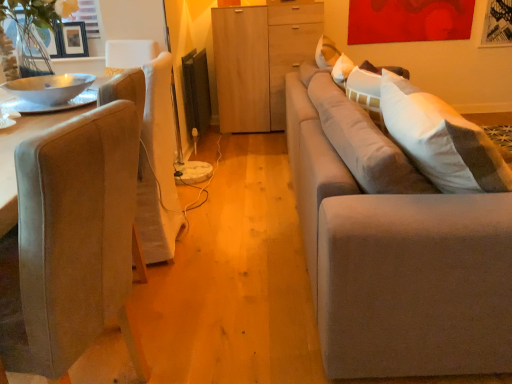
Locate an element on the screen. The width and height of the screenshot is (512, 384). suede gray couch at right is located at coordinates (393, 248).

The image size is (512, 384). Find the location of `white glossy bowl at left`. white glossy bowl at left is located at coordinates (49, 87).

Considering their positions, is matte black picture frame at upper left located in front of or behind suede-like beige chair at left?

matte black picture frame at upper left is behind suede-like beige chair at left.

Choose the correct answer: Is matte black picture frame at upper left inside suede-like beige chair at left or outside it?

matte black picture frame at upper left is outside suede-like beige chair at left.

From the image's perspective, is matte black picture frame at upper left above suede-like beige chair at left?

Yes, from the image's perspective, matte black picture frame at upper left is over suede-like beige chair at left.

Find the location of a particular element. picture frame on the left of suede-like beige chair at left is located at coordinates (73, 39).

Does point (70, 33) come farther from viewer compared to point (312, 221)?

Yes, it is.

Are matte black picture frame at upper left and suede gray couch at right making contact?

matte black picture frame at upper left is not next to suede gray couch at right, and they're not touching.

There is a suede gray couch at right. Where is `picture frame above it (from a real-world perspective)`? The width and height of the screenshot is (512, 384). picture frame above it (from a real-world perspective) is located at coordinates [73, 39].

From the image's perspective, which is below, matte black picture frame at upper left or suede gray couch at right?

From the image's view, suede gray couch at right is below.

Does white glossy bowl at left have a larger size compared to suede gray couch at right?

Actually, white glossy bowl at left might be smaller than suede gray couch at right.

Is white glossy bowl at left positioned with its back to suede gray couch at right?

No, suede gray couch at right is not at the back of white glossy bowl at left.

In the scene shown: From a real-world perspective, who is located lower, white glossy bowl at left or suede gray couch at right?

suede gray couch at right, from a real-world perspective.

What's the angular difference between white glossy bowl at left and suede gray couch at right's facing directions?

The facing directions of white glossy bowl at left and suede gray couch at right are 176 degrees apart.

Looking at their sizes, would you say white glossy bowl at left is wider or thinner than suede-like beige chair at left?

Clearly, white glossy bowl at left has less width compared to suede-like beige chair at left.

Based on the photo, who is bigger, white glossy bowl at left or suede-like beige chair at left?

suede-like beige chair at left is bigger.

Which of these two, white glossy bowl at left or suede-like beige chair at left, stands taller?

Standing taller between the two is suede-like beige chair at left.

Is point (70, 89) positioned in front of point (103, 258)?

That is False.

From the image's perspective, does suede gray couch at right appear higher than suede-like beige chair at left?

Yes, from the image's perspective, suede gray couch at right is above suede-like beige chair at left.

How much distance is there between suede gray couch at right and suede-like beige chair at left?

suede gray couch at right and suede-like beige chair at left are 75.94 centimeters apart from each other.

Which of these two, suede gray couch at right or suede-like beige chair at left, is wider?

With larger width is suede gray couch at right.

Is suede gray couch at right in contact with suede-like beige chair at left?

No, suede gray couch at right is not next to suede-like beige chair at left.

Identify the location of bowl on the left side of suede-like beige chair at left. Image resolution: width=512 pixels, height=384 pixels. (49, 87).

Who is more distant, suede-like beige chair at left or white glossy bowl at left?

white glossy bowl at left is more distant.

From a real-world perspective, who is located higher, suede-like beige chair at left or white glossy bowl at left?

In real-world perspective, white glossy bowl at left is above.

Is suede-like beige chair at left positioned far away from white glossy bowl at left?

That's right, there is a large distance between suede-like beige chair at left and white glossy bowl at left.

From a real-world perspective, between suede gray couch at right and white glossy bowl at left, who is vertically lower?

suede gray couch at right.

Is suede gray couch at right oriented away from white glossy bowl at left?

Absolutely, suede gray couch at right is directed away from white glossy bowl at left.

You are a GUI agent. You are given a task and a screenshot of the screen. Output one action in this format:
    pyautogui.click(x=<x>, y=<y>)
    Task: Click on the chair that appears on the right of matte black picture frame at upper left
    
    Given the screenshot: What is the action you would take?
    pyautogui.click(x=76, y=236)

The height and width of the screenshot is (384, 512). I want to click on studio couch located underneath the matte black picture frame at upper left (from a real-world perspective), so click(x=393, y=248).

When comparing their distances from white glossy bowl at left, does suede-like beige chair at left or suede gray couch at right seem further?

suede gray couch at right lies further to white glossy bowl at left than the other object.

When comparing their distances from matte black picture frame at upper left, does suede-like beige chair at left or light wood cabinet at center seem closer?

Based on the image, light wood cabinet at center appears to be nearer to matte black picture frame at upper left.

Based on their spatial positions, is suede-like beige chair at left or white glossy bowl at left further from matte black picture frame at upper left?

suede-like beige chair at left is further to matte black picture frame at upper left.

Considering their positions, is suede gray couch at right positioned closer to suede-like beige chair at left than white glossy bowl at left?

suede gray couch at right.

Based on their spatial positions, is light wood cabinet at center or suede-like beige chair at left closer to suede gray couch at right?

suede-like beige chair at left lies closer to suede gray couch at right than the other object.

Which object lies further to the anchor point suede-like beige chair at left, light wood cabinet at center or white glossy bowl at left?

Among the two, light wood cabinet at center is located further to suede-like beige chair at left.

Based on the photo, estimate the real-world distances between objects in this image. Which object is further from suede-like beige chair at left, matte black picture frame at upper left or suede gray couch at right?

matte black picture frame at upper left is further to suede-like beige chair at left.

Considering their positions, is suede gray couch at right positioned further to suede-like beige chair at left than light wood cabinet at center?

Among the two, light wood cabinet at center is located further to suede-like beige chair at left.

At what (x,y) coordinates should I click in order to perform the action: click on picture frame between suede gray couch at right and light wood cabinet at center from front to back. Please return your answer as a coordinate pair (x, y). The image size is (512, 384). Looking at the image, I should click on (73, 39).

Image resolution: width=512 pixels, height=384 pixels. I want to click on bowl between suede-like beige chair at left and light wood cabinet at center along the z-axis, so point(49,87).

Find the location of a particular element. The width and height of the screenshot is (512, 384). bowl between suede gray couch at right and light wood cabinet at center along the z-axis is located at coordinates tap(49, 87).

Where is `bowl between suede-like beige chair at left and matte black picture frame at upper left along the z-axis`? Image resolution: width=512 pixels, height=384 pixels. bowl between suede-like beige chair at left and matte black picture frame at upper left along the z-axis is located at coordinates (49, 87).